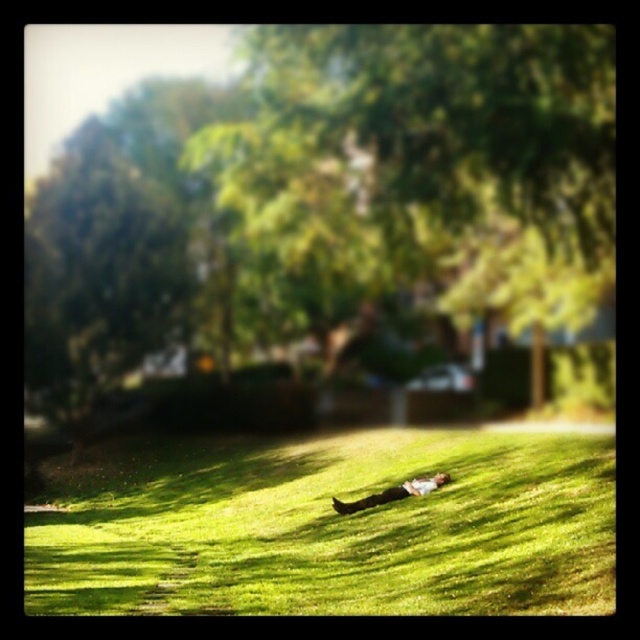
Question: From the image, what is the correct spatial relationship of green leafy tree at center in relation to light brown leather jacket at center?

Choices:
 (A) below
 (B) above

Answer: (B)

Question: Considering the real-world distances, which object is farthest from the green leafy tree at center?

Choices:
 (A) green grass at lower center
 (B) light brown leather jacket at center

Answer: (B)

Question: Is green grass at lower center thinner than light brown leather jacket at center?

Choices:
 (A) no
 (B) yes

Answer: (A)

Question: Which object is closer to the camera taking this photo?

Choices:
 (A) green leafy tree at center
 (B) green grass at lower center

Answer: (B)

Question: Which of the following is the closest to the observer?

Choices:
 (A) light brown leather jacket at center
 (B) green leafy tree at center
 (C) green grass at lower center

Answer: (C)

Question: Is green leafy tree at center positioned before green grass at lower center?

Choices:
 (A) yes
 (B) no

Answer: (B)